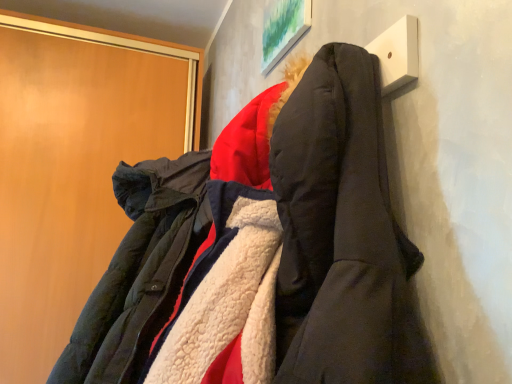
Describe the element at coordinates (264, 256) in the screenshot. The image size is (512, 384). I see `white fleece jacket at center` at that location.

The width and height of the screenshot is (512, 384). Identify the location of white fleece jacket at center. (264, 256).

At what (x,y) coordinates should I click in order to perform the action: click on white fleece jacket at center. Please return your answer as a coordinate pair (x, y). Looking at the image, I should click on (264, 256).